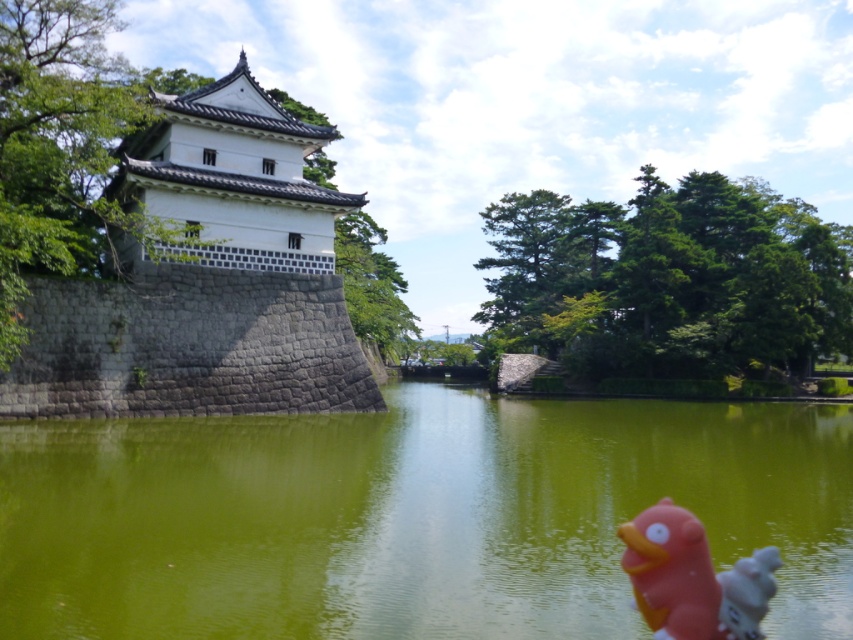
You are standing in front of the traditional Japanese tower and want to take a photo of the two points labeled as point (271, 518) and point (717, 634). Which point will appear closer to the camera in your photo?

Point (271, 518) is further to the camera than point (717, 634), so it will appear closer to the camera in the photo.

You are standing in front of the traditional Japanese tower and want to know how far you are from the point marked at coordinates point (80, 445). Can you determine the distance?

You are 121.23 feet away from the point marked at coordinates point (80, 445).